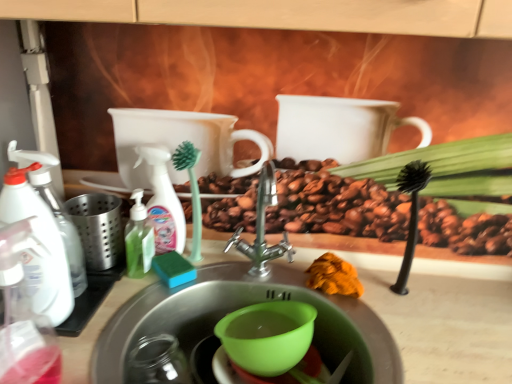
Identify the location of free space above green plastic bowl at center (from a real-world perspective). (262, 286).